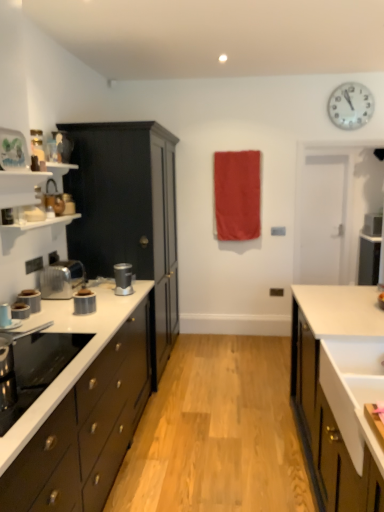
The image size is (384, 512). What do you see at coordinates (61, 279) in the screenshot?
I see `polished stainless steel kettle at left, placed as the 2th kitchen appliance when sorted from back to front` at bounding box center [61, 279].

The image size is (384, 512). I want to click on white glossy clock at upper right, so click(350, 106).

This screenshot has height=512, width=384. What do you see at coordinates (84, 301) in the screenshot? I see `metallic silver tape at left, arranged as the 4th kitchen appliance when viewed from the back` at bounding box center [84, 301].

How much space does metallic silver tape at left, arranged as the 4th kitchen appliance when viewed from the back, occupy horizontally?

The width of metallic silver tape at left, arranged as the 4th kitchen appliance when viewed from the back, is 5.71 inches.

Image resolution: width=384 pixels, height=512 pixels. In order to click on polished stainless steel kettle at left, placed as the fifth kitchen appliance when sorted from front to back in this screenshot , I will do `click(61, 279)`.

Between point (31, 293) and point (152, 140), which one is positioned behind?

The point (152, 140) is farther from the camera.

Is matte silver toaster at left, which is counted as the third kitchen appliance, starting from the back, bigger than matte black cabinet at left, arranged as the 2th cabinetry when viewed from the right?

No, matte silver toaster at left, which is counted as the third kitchen appliance, starting from the back, is not bigger than matte black cabinet at left, arranged as the 2th cabinetry when viewed from the right.

Which is behind, matte silver toaster at left, which is counted as the third kitchen appliance, starting from the back, or matte black cabinet at left, placed as the 2th cabinetry when sorted from left to right?

Positioned behind is matte black cabinet at left, placed as the 2th cabinetry when sorted from left to right.

Is matte silver toaster at left, the 4th kitchen appliance from the front, oriented away from matte black cabinet at left, placed as the 2th cabinetry when sorted from left to right?

matte silver toaster at left, the 4th kitchen appliance from the front, is not turned away from matte black cabinet at left, placed as the 2th cabinetry when sorted from left to right.

Can you tell me how much red fabric at center and matte silver toaster at left, the 4th kitchen appliance from the front, differ in facing direction?

red fabric at center and matte silver toaster at left, the 4th kitchen appliance from the front, are facing 87.7 degrees away from each other.

Between red fabric at center and matte silver toaster at left, which is counted as the third kitchen appliance, starting from the back, which one appears on the right side from the viewer's perspective?

red fabric at center.

Considering the sizes of red fabric at center and matte silver toaster at left, which is counted as the third kitchen appliance, starting from the back, in the image, is red fabric at center taller or shorter than matte silver toaster at left, which is counted as the third kitchen appliance, starting from the back,?

In the image, red fabric at center appears to be taller than matte silver toaster at left, which is counted as the third kitchen appliance, starting from the back.

Is red fabric at center oriented away from matte silver toaster at left, which is counted as the third kitchen appliance, starting from the back?

No, red fabric at center's orientation is not away from matte silver toaster at left, which is counted as the third kitchen appliance, starting from the back.

Which object is closer to the camera taking this photo, red fabric at center or metallic silver faucet at upper right?

red fabric at center is more forward.

From a real-world perspective, who is located higher, red fabric at center or metallic silver faucet at upper right?

red fabric at center, from a real-world perspective.

Is red fabric at center not close to metallic silver faucet at upper right?

red fabric at center is far away from metallic silver faucet at upper right.

Who is more distant, matte black cabinet at left, arranged as the 2th cabinetry when viewed from the right, or red fabric at center?

red fabric at center is further away from the camera.

What's the angular difference between matte black cabinet at left, placed as the 2th cabinetry when sorted from left to right, and red fabric at center's facing directions?

The angle between the facing direction of matte black cabinet at left, placed as the 2th cabinetry when sorted from left to right, and the facing direction of red fabric at center is 87.8 degrees.

Can you see matte black cabinet at left, arranged as the 2th cabinetry when viewed from the right, touching red fabric at center?

No, matte black cabinet at left, arranged as the 2th cabinetry when viewed from the right, is not touching red fabric at center.

From a real-world perspective, who is located lower, white glossy clock at upper right or red fabric at center?

red fabric at center is physically lower.

Is white glossy clock at upper right outside of red fabric at center?

white glossy clock at upper right lies outside red fabric at center's area.

Considering the sizes of objects white glossy clock at upper right and red fabric at center in the image provided, who is thinner, white glossy clock at upper right or red fabric at center?

white glossy clock at upper right.

From the image's perspective, which object appears higher, white glossy clock at upper right or red fabric at center?

white glossy clock at upper right appears higher in the image.

You are a GUI agent. You are given a task and a screenshot of the screen. Output one action in this format:
    pyautogui.click(x=<x>, y=<y>)
    Task: Click on the kitchen appliance that is the 1st object directly below the red fabric at center (from a real-world perspective)
    
    Given the screenshot: What is the action you would take?
    pyautogui.click(x=61, y=279)

Could you tell me if red fabric at center is facing polished stainless steel kettle at left, placed as the fifth kitchen appliance when sorted from front to back?

No, red fabric at center is not oriented towards polished stainless steel kettle at left, placed as the fifth kitchen appliance when sorted from front to back.

Between red fabric at center and polished stainless steel kettle at left, placed as the 2th kitchen appliance when sorted from back to front, which one has more height?

With more height is red fabric at center.

Can you confirm if red fabric at center is bigger than polished stainless steel kettle at left, placed as the 2th kitchen appliance when sorted from back to front?

Indeed, red fabric at center has a larger size compared to polished stainless steel kettle at left, placed as the 2th kitchen appliance when sorted from back to front.

Consider the image. From the image's perspective, which is below, matte silver toaster at left, which is the 1th kitchen appliance from front to back, or metallic silver faucet at upper right?

matte silver toaster at left, which is the 1th kitchen appliance from front to back, appears lower in the image.

Considering the positions of objects matte silver toaster at left, which is the sixth kitchen appliance in back-to-front order, and metallic silver faucet at upper right in the image provided, who is behind, matte silver toaster at left, which is the sixth kitchen appliance in back-to-front order, or metallic silver faucet at upper right?

metallic silver faucet at upper right is further away from the camera.

Considering the relative positions of matte silver toaster at left, which is the 1th kitchen appliance from front to back, and metallic silver faucet at upper right in the image provided, is matte silver toaster at left, which is the 1th kitchen appliance from front to back, to the left of metallic silver faucet at upper right from the viewer's perspective?

Yes, matte silver toaster at left, which is the 1th kitchen appliance from front to back, is to the left of metallic silver faucet at upper right.

Which object is thinner, matte silver toaster at left, which is the sixth kitchen appliance in back-to-front order, or metallic silver faucet at upper right?

With smaller width is matte silver toaster at left, which is the sixth kitchen appliance in back-to-front order.

In order to click on the 3rd kitchen appliance counting from the left of the matte black cabinet at left, placed as the 2th cabinetry when sorted from left to right in this screenshot , I will do `click(31, 298)`.

At what (x,y) coordinates should I click in order to perform the action: click on curtain above the matte silver toaster at left, the 4th kitchen appliance from the front (from a real-world perspective). Please return your answer as a coordinate pair (x, y). The width and height of the screenshot is (384, 512). Looking at the image, I should click on (237, 195).

Based on their spatial positions, is matte silver toaster at left, the 4th kitchen appliance from the front, or metallic silver faucet at upper right closer to matte black cabinets at left, the 3th cabinetry positioned from the right?

Based on the image, matte silver toaster at left, the 4th kitchen appliance from the front, appears to be nearer to matte black cabinets at left, the 3th cabinetry positioned from the right.

Considering their positions, is matte black cabinets at left, the 1th cabinetry from the left, positioned further to satin silver blender at center, the 1th kitchen appliance positioned from the back, than white glossy sink at lower right?

Among the two, white glossy sink at lower right is located further to satin silver blender at center, the 1th kitchen appliance positioned from the back.

Which object lies nearer to the anchor point metallic silver toaster at left, which is the second kitchen appliance from front to back, satin silver blender at center, arranged as the 6th kitchen appliance when viewed from the front, or metallic silver faucet at upper right?

satin silver blender at center, arranged as the 6th kitchen appliance when viewed from the front.

Considering their positions, is satin silver blender at center, the 1th kitchen appliance positioned from the back, positioned further to metallic silver toaster at left, the 5th kitchen appliance positioned from the back, than white matte sink at right, which ranks as the third cabinetry in left-to-right order?

white matte sink at right, which ranks as the third cabinetry in left-to-right order, lies further to metallic silver toaster at left, the 5th kitchen appliance positioned from the back, than the other object.

Estimate the real-world distances between objects in this image. Which object is closer to red fabric at center, metallic silver faucet at upper right or metallic silver toaster at left, the 5th kitchen appliance positioned from the back?

Among the two, metallic silver faucet at upper right is located nearer to red fabric at center.

From the image, which object appears to be farther from white matte sink at right, which ranks as the third cabinetry in left-to-right order, satin silver blender at center, arranged as the 6th kitchen appliance when viewed from the front, or matte silver toaster at left, the 4th kitchen appliance from the front?

Based on the image, matte silver toaster at left, the 4th kitchen appliance from the front, appears to be further to white matte sink at right, which ranks as the third cabinetry in left-to-right order.

Considering their positions, is white glossy sink at lower right positioned further to satin silver blender at center, the 1th kitchen appliance positioned from the back, than matte silver toaster at left, which is the 1th kitchen appliance from front to back?

white glossy sink at lower right is positioned further to the anchor satin silver blender at center, the 1th kitchen appliance positioned from the back.

When comparing their distances from white matte sink at right, which ranks as the third cabinetry in left-to-right order, does polished stainless steel kettle at left, placed as the 2th kitchen appliance when sorted from back to front, or metallic silver faucet at upper right seem closer?

polished stainless steel kettle at left, placed as the 2th kitchen appliance when sorted from back to front, lies closer to white matte sink at right, which ranks as the third cabinetry in left-to-right order, than the other object.

You are a GUI agent. You are given a task and a screenshot of the screen. Output one action in this format:
    pyautogui.click(x=<x>, y=<y>)
    Task: Click on the curtain situated between metallic silver toaster at left, which is the second kitchen appliance from front to back, and metallic silver faucet at upper right from left to right
    This screenshot has width=384, height=512.
    Given the screenshot: What is the action you would take?
    pyautogui.click(x=237, y=195)

You are a GUI agent. You are given a task and a screenshot of the screen. Output one action in this format:
    pyautogui.click(x=<x>, y=<y>)
    Task: Click on the clock between satin silver blender at center, arranged as the 6th kitchen appliance when viewed from the front, and metallic silver faucet at upper right
    
    Given the screenshot: What is the action you would take?
    pyautogui.click(x=350, y=106)

This screenshot has height=512, width=384. I want to click on sink between white matte sink at right, positioned as the first cabinetry in right-to-left order, and red fabric at center from front to back, so click(x=353, y=391).

Identify the location of sink between matte black cabinets at left, the 1th cabinetry from the left, and white matte sink at right, positioned as the first cabinetry in right-to-left order. This screenshot has height=512, width=384. (353, 391).